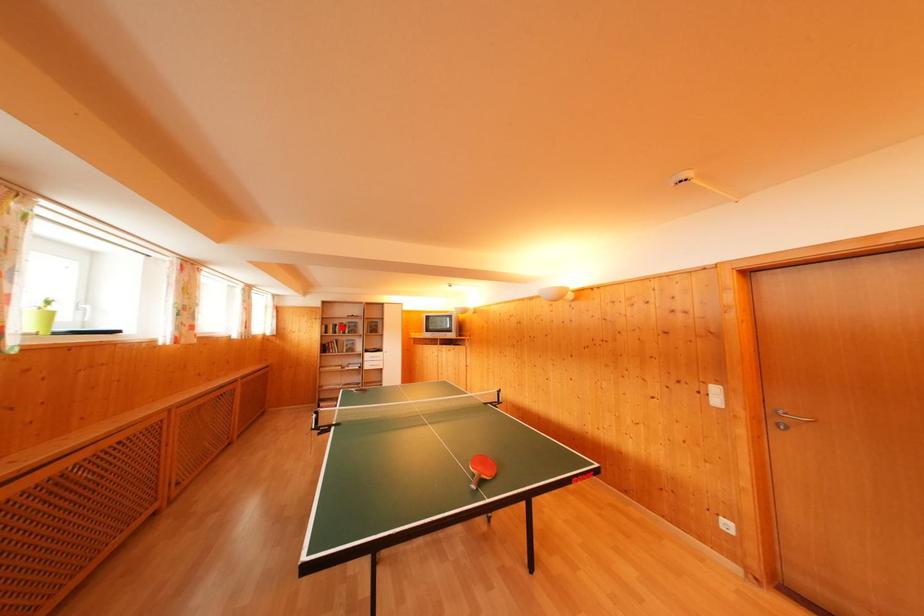
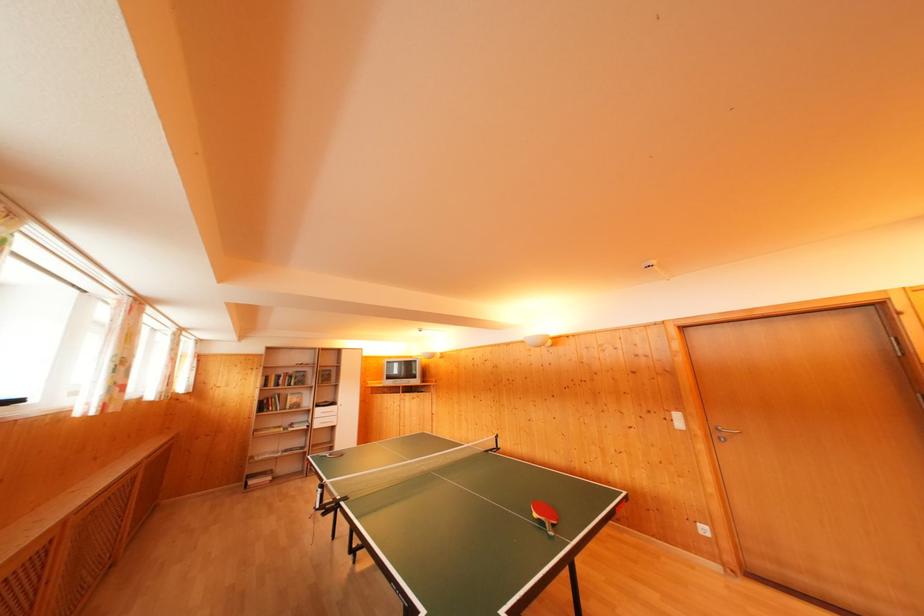
The point at the highlighted location is marked in the first image. Where is the corresponding point in the second image?

(286, 377)